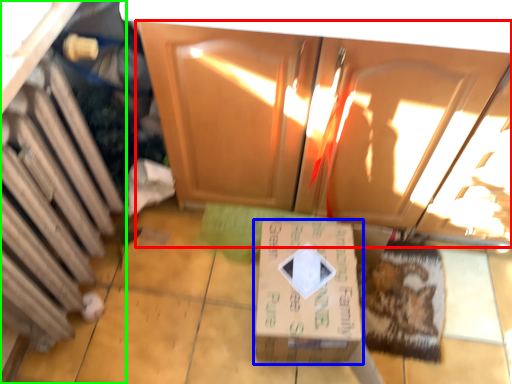
Question: Based on their relative distances, which object is farther from cabinetry (highlighted by a red box)? Choose from box (highlighted by a blue box) and cabinetry (highlighted by a green box).

Choices:
 (A) box
 (B) cabinetry

Answer: (B)